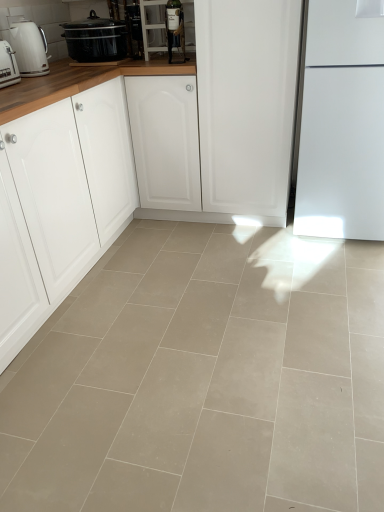
Question: Does matte glass wine bottle at upper center, which ranks as the second appliance in left-to-right order, have a larger size compared to metallic glass bottle at upper center, the 1th appliance when ordered from left to right?

Choices:
 (A) no
 (B) yes

Answer: (B)

Question: Is matte glass wine bottle at upper center, arranged as the second appliance when viewed from the back, shorter than metallic glass bottle at upper center, which is the 2th appliance in front-to-back order?

Choices:
 (A) no
 (B) yes

Answer: (A)

Question: Is the depth of matte glass wine bottle at upper center, which ranks as the second appliance in left-to-right order, less than that of metallic glass bottle at upper center, placed as the 1th appliance when sorted from back to front?

Choices:
 (A) yes
 (B) no

Answer: (A)

Question: From a real-world perspective, is matte glass wine bottle at upper center, which ranks as the second appliance in left-to-right order, on top of metallic glass bottle at upper center, the 1th appliance when ordered from left to right?

Choices:
 (A) no
 (B) yes

Answer: (B)

Question: Is matte glass wine bottle at upper center, the first appliance viewed from the front, oriented away from metallic glass bottle at upper center, the 2th appliance when ordered from right to left?

Choices:
 (A) yes
 (B) no

Answer: (B)

Question: From a real-world perspective, is matte glass wine bottle at upper center, arranged as the second appliance when viewed from the back, positioned above or below matte black slow cooker at upper left?

Choices:
 (A) above
 (B) below

Answer: (A)

Question: Would you say matte glass wine bottle at upper center, placed as the 1th appliance when sorted from right to left, is to the left or to the right of matte black slow cooker at upper left in the picture?

Choices:
 (A) right
 (B) left

Answer: (A)

Question: In terms of height, does matte glass wine bottle at upper center, which ranks as the second appliance in left-to-right order, look taller or shorter compared to matte black slow cooker at upper left?

Choices:
 (A) tall
 (B) short

Answer: (A)

Question: Is matte glass wine bottle at upper center, arranged as the second appliance when viewed from the back, spatially inside matte black slow cooker at upper left, or outside of it?

Choices:
 (A) outside
 (B) inside

Answer: (A)

Question: Considering the positions of white glossy kettle at left, the 1th kitchen appliance from the back, and beige tile floor at center in the image, is white glossy kettle at left, the 1th kitchen appliance from the back, wider or thinner than beige tile floor at center?

Choices:
 (A) wide
 (B) thin

Answer: (B)

Question: Based on their positions, is white glossy kettle at left, the 1th kitchen appliance from the back, located to the left or right of beige tile floor at center?

Choices:
 (A) right
 (B) left

Answer: (B)

Question: From a real-world perspective, is white glossy kettle at left, the 1th kitchen appliance from the back, above or below beige tile floor at center?

Choices:
 (A) below
 (B) above

Answer: (B)

Question: Considering their positions, is white glossy kettle at left, the 1th kitchen appliance from the back, located in front of or behind beige tile floor at center?

Choices:
 (A) front
 (B) behind

Answer: (B)

Question: In the image, is white glossy kettle at left, the 1th kitchen appliance from the back, positioned in front of or behind white matte cabinet at left?

Choices:
 (A) front
 (B) behind

Answer: (B)

Question: From the image's perspective, is white glossy kettle at left, the 1th kitchen appliance from the back, positioned above or below white matte cabinet at left?

Choices:
 (A) above
 (B) below

Answer: (A)